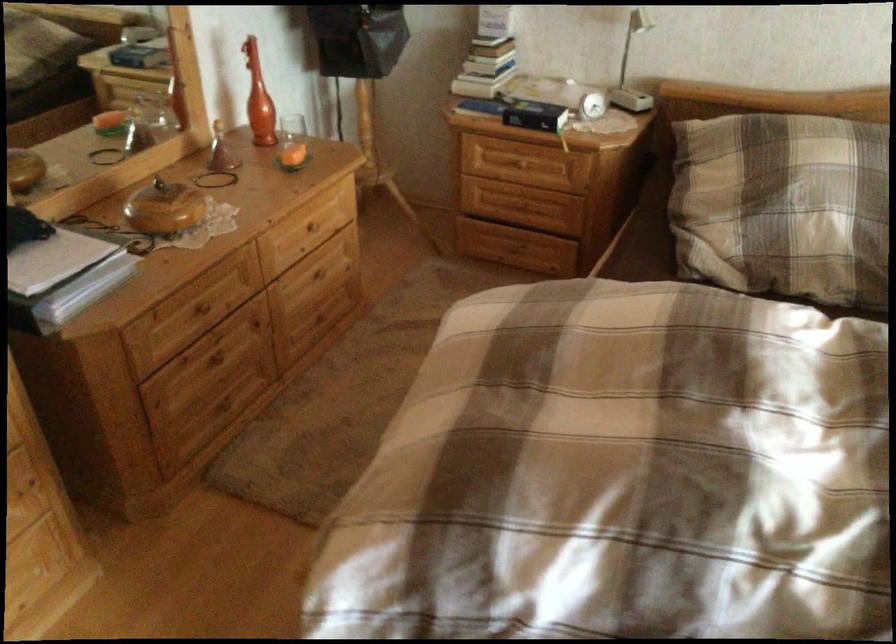
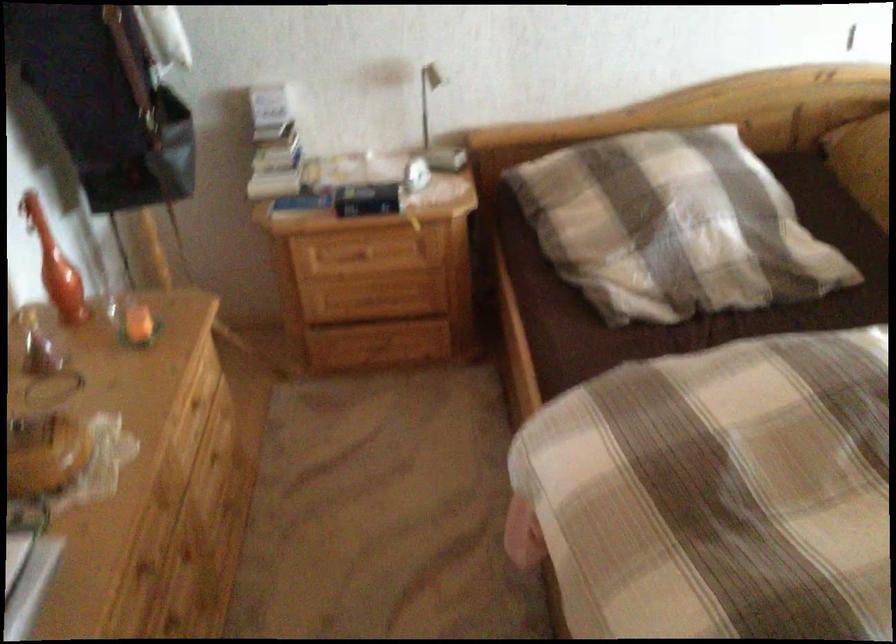
Find the pixel in the second image that matches point (786, 205) in the first image.

(673, 225)